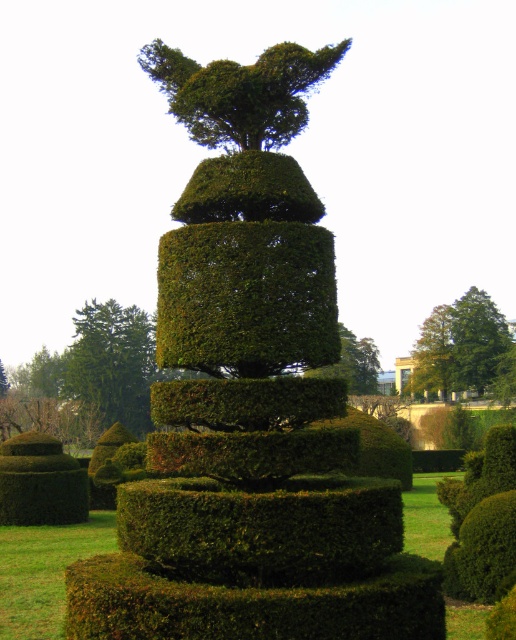
Question: Which point is closer to the camera?

Choices:
 (A) (367, 387)
 (B) (107, 378)
 (C) (462, 353)

Answer: (B)

Question: Observing the image, what is the correct spatial positioning of green leafy tree at upper center in reference to green leafy bush at center?

Choices:
 (A) above
 (B) below

Answer: (A)

Question: Is green leafy tree at left thinner than green leafy tree at upper center?

Choices:
 (A) yes
 (B) no

Answer: (B)

Question: Considering the real-world distances, which object is closest to the green leafy tree at left?

Choices:
 (A) green leafy bush at center
 (B) green leafy tree at upper center

Answer: (A)

Question: Is green leafy tree at left positioned behind green leafy bush at center?

Choices:
 (A) yes
 (B) no

Answer: (A)

Question: Which point is closer to the camera taking this photo?

Choices:
 (A) (481, 336)
 (B) (374, 364)
 (C) (99, 317)

Answer: (C)